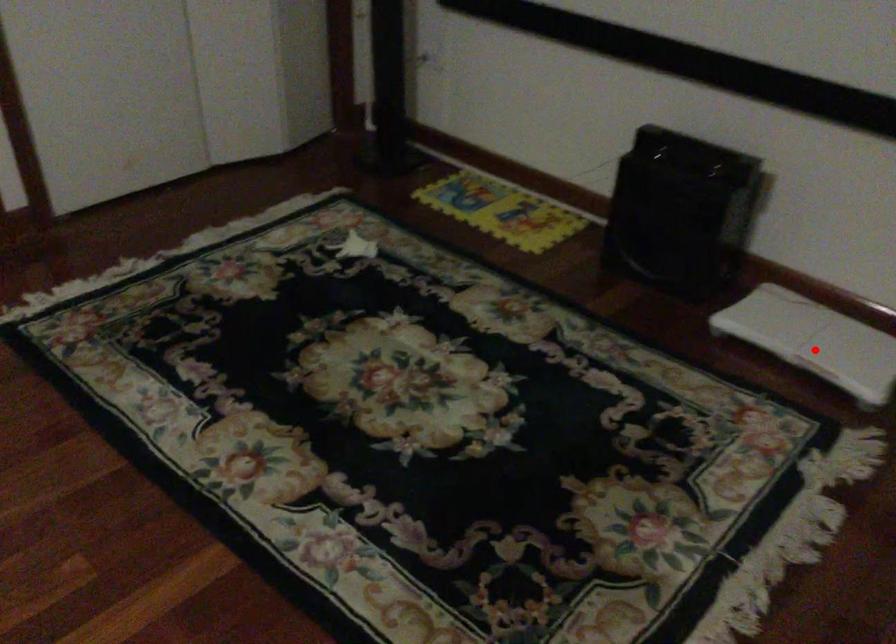
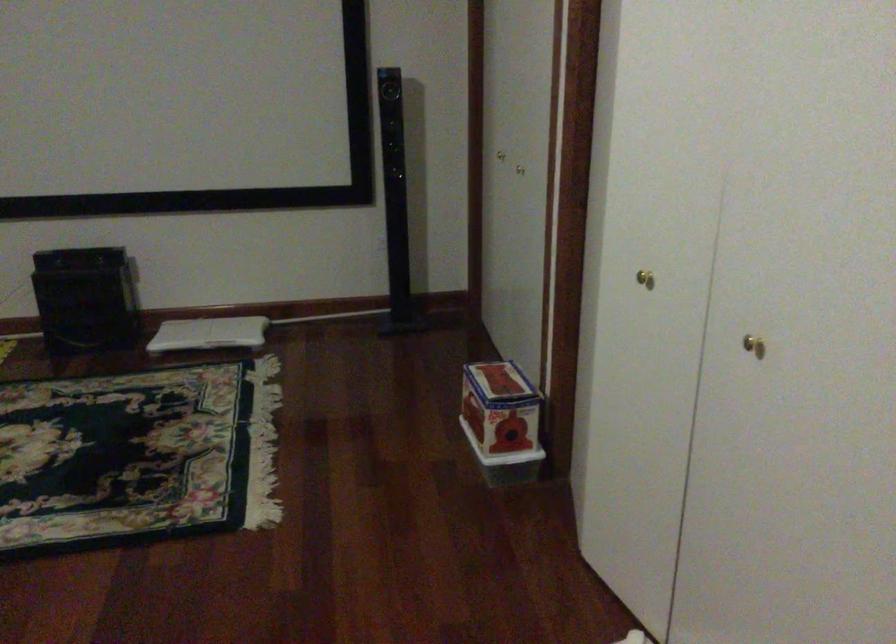
Locate, in the second image, the point that corresponds to the highlighted location in the first image.

(209, 333)